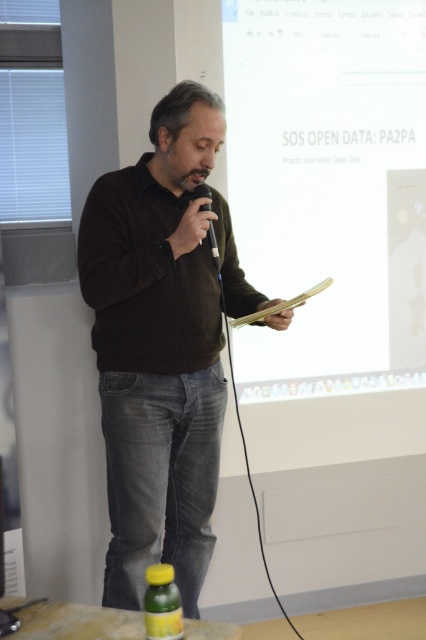
Does white matte projection screen at upper center have a smaller size compared to green matte bottle at lower center?

No, white matte projection screen at upper center is not smaller than green matte bottle at lower center.

Who is positioned more to the right, white matte projection screen at upper center or green matte bottle at lower center?

white matte projection screen at upper center is more to the right.

Where is `white matte projection screen at upper center`? white matte projection screen at upper center is located at coordinates (330, 188).

I want to click on white matte projection screen at upper center, so click(330, 188).

Is white matte projection screen at upper center positioned before black plastic microphone at center?

That is False.

What do you see at coordinates (330, 188) in the screenshot? The height and width of the screenshot is (640, 426). I see `white matte projection screen at upper center` at bounding box center [330, 188].

Who is more forward, (376, 144) or (215, 266)?

Point (215, 266) is more forward.

Locate an element on the screen. white matte projection screen at upper center is located at coordinates (330, 188).

Measure the distance between point (173, 307) and camera.

Point (173, 307) is 6.81 feet away from camera.

Between point (236, 284) and point (175, 608), which one is positioned behind?

Point (236, 284)

The image size is (426, 640). I want to click on brown matte sweater at center, so click(x=161, y=344).

Identify the location of brown matte sweater at center. (161, 344).